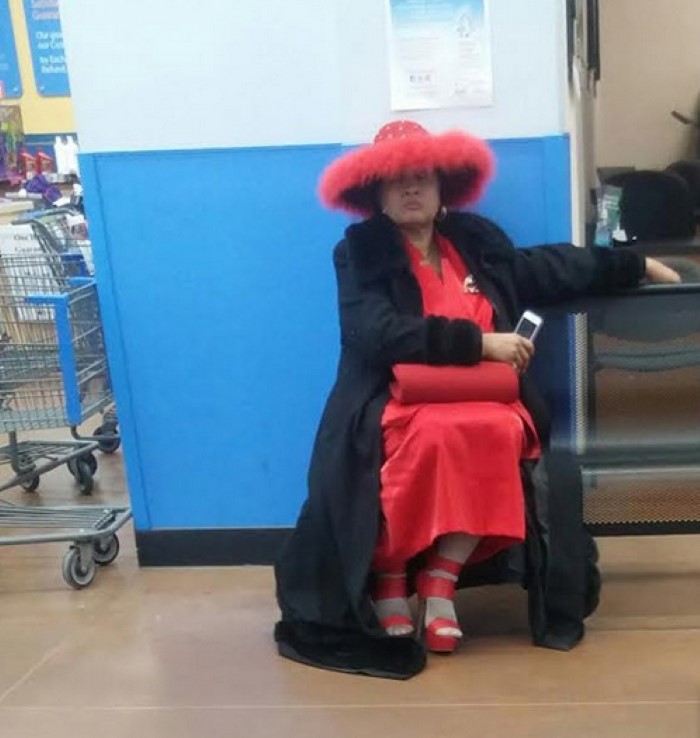
In order to click on dark blue wall in this screenshot , I will do `click(220, 280)`.